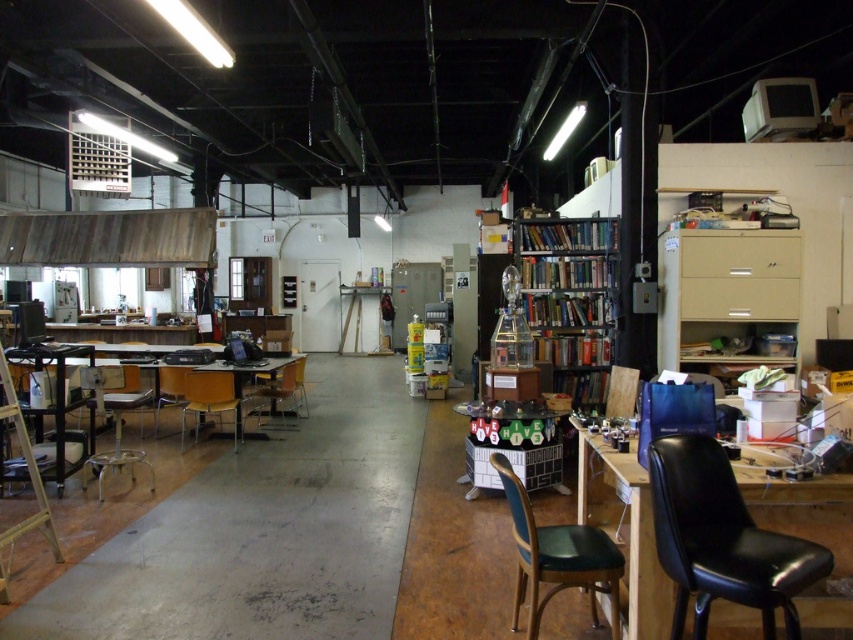
Question: From the image, what is the correct spatial relationship of green matte bookshelf at center in relation to wooden chair at left?

Choices:
 (A) left
 (B) right

Answer: (B)

Question: Which object is farther from the camera taking this photo?

Choices:
 (A) wooden ladder at left
 (B) green matte bookshelf at center
 (C) wooden chair at left
 (D) wooden table at left

Answer: (C)

Question: In this image, where is green matte bookshelf at center located relative to wooden chair at center?

Choices:
 (A) left
 (B) right

Answer: (B)

Question: Does wooden ladder at left lie behind wooden chair at center?

Choices:
 (A) yes
 (B) no

Answer: (B)

Question: Which of the following is the farthest from the observer?

Choices:
 (A) (206, 397)
 (B) (67, 353)

Answer: (A)

Question: Among these points, which one is farthest from the camera?

Choices:
 (A) (279, 396)
 (B) (587, 230)
 (C) (489, 458)
 (D) (35, 490)

Answer: (A)